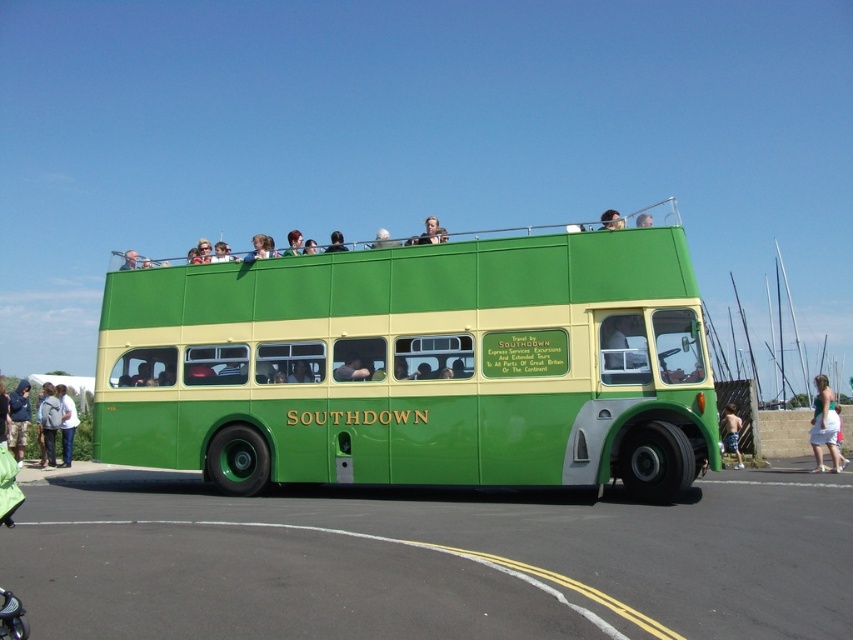
You are a photographer standing in front of the Southdown double decker bus. You notice a white cotton skirt at lower right and a light gray backpack at lower left. Which object is taller?

The white cotton skirt at lower right is much taller than the light gray backpack at lower left.

In the scene shown: You are a passenger on the double decker bus and you want to move from the lower left to the lower right to get a better view. Is there a clear path between the light gray backpack at lower left and the white cotton skirt at lower right?

The white cotton skirt at lower right is in front of the light gray backpack at lower left, so there is no clear path between them. You may need to move around the objects.